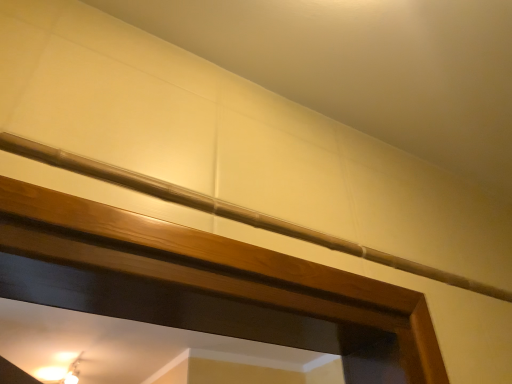
Find the location of `wooden beam at upper center`. wooden beam at upper center is located at coordinates (230, 211).

The height and width of the screenshot is (384, 512). Describe the element at coordinates (230, 211) in the screenshot. I see `wooden beam at upper center` at that location.

Locate an element on the screen. This screenshot has width=512, height=384. wooden beam at upper center is located at coordinates (230, 211).